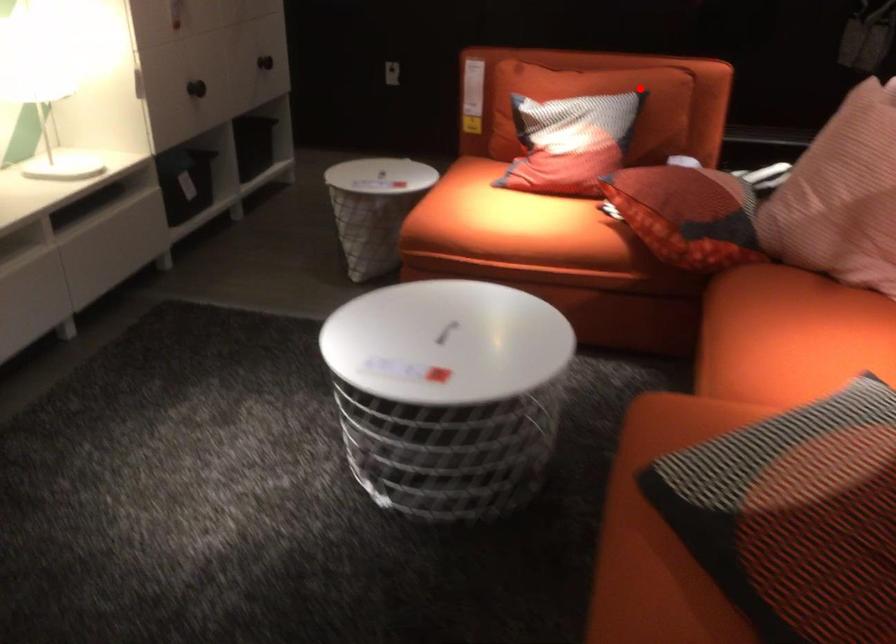
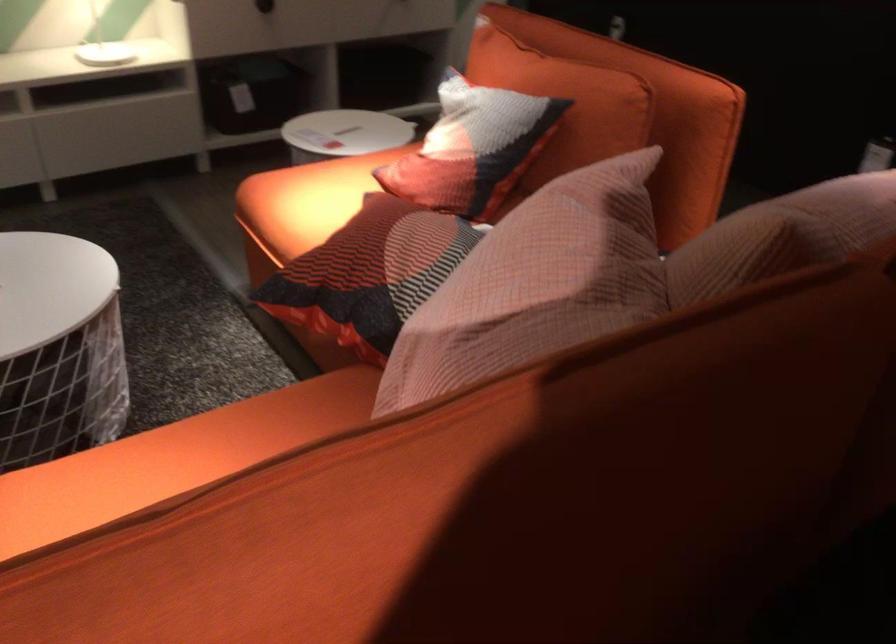
Question: I am providing you with two images of the same scene from different viewpoints. Image1 has a red point marked. In image2, the corresponding 3D location appears at what relative position? Reply with the corresponding letter.

Choices:
 (A) Closer
 (B) Farther

Answer: (A)